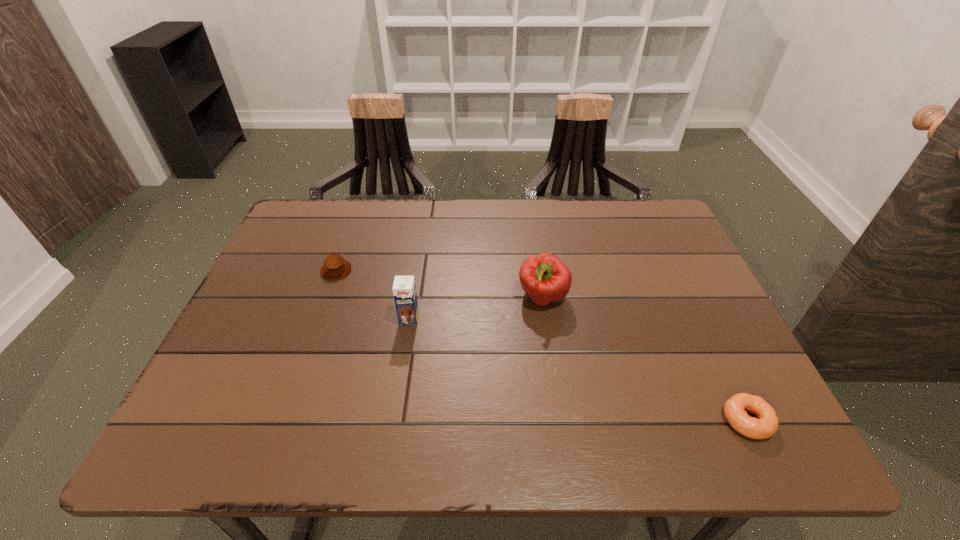
This screenshot has width=960, height=540. Identify the location of the second object from left to right. (404, 290).

Locate an element on the screen. The height and width of the screenshot is (540, 960). bell pepper is located at coordinates (544, 277).

Locate an element on the screen. The image size is (960, 540). the leftmost object is located at coordinates (335, 267).

Locate an element on the screen. The image size is (960, 540). doughnut is located at coordinates (735, 408).

The width and height of the screenshot is (960, 540). Find the location of `the shortest object`. the shortest object is located at coordinates (735, 408).

The height and width of the screenshot is (540, 960). I want to click on free location located 0.230m on the front label of the chocolate milk, so click(395, 416).

You are a GUI agent. You are given a task and a screenshot of the screen. Output one action in this format:
    pyautogui.click(x=<x>, y=<y>)
    Task: Click on the free spot located on the back of the bell pepper
    
    Given the screenshot: What is the action you would take?
    pyautogui.click(x=539, y=267)

Find the location of a particular element. vacant area situated 0.050m on the right of the leftmost object is located at coordinates (371, 271).

This screenshot has height=540, width=960. I want to click on free space located 0.100m on the back of the rightmost object, so click(x=717, y=359).

Find the location of a particular element. The image size is (960, 540). object at the near edge is located at coordinates (735, 408).